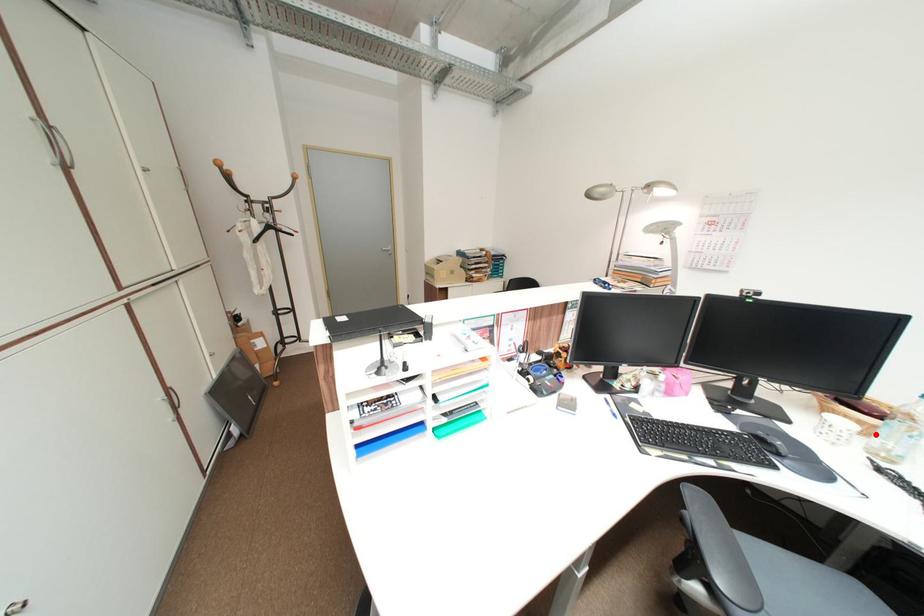
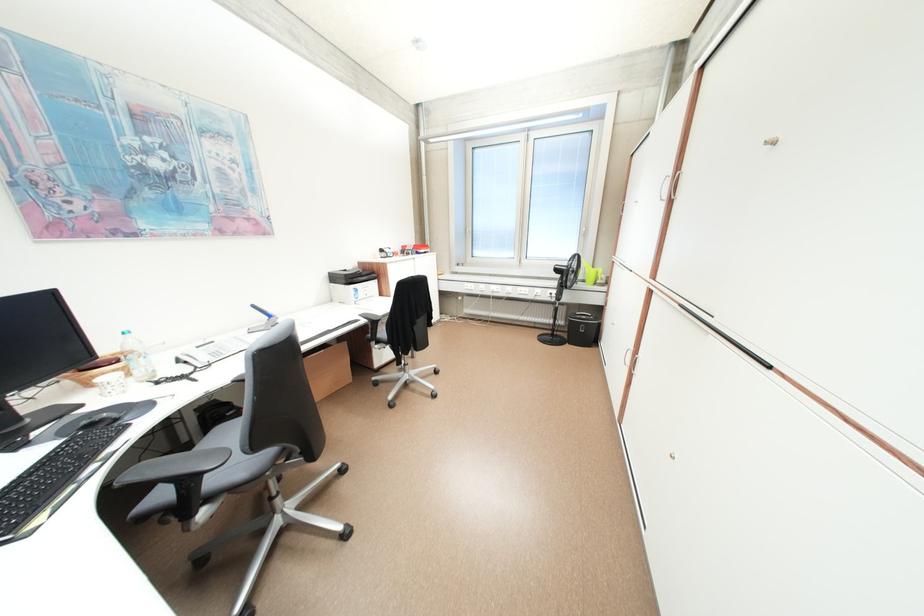
In the second image, find the point that corresponds to the highlighted location in the first image.

(138, 374)